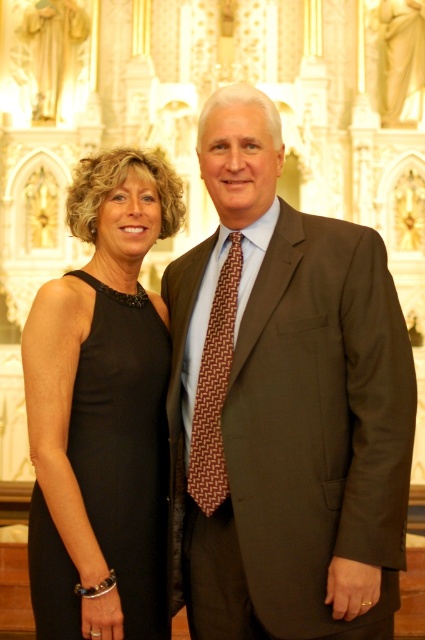
Question: Can you confirm if black satin dress at left is positioned below brown woven tie at center?

Choices:
 (A) yes
 (B) no

Answer: (A)

Question: Is brown textured suit at center to the left of black satin dress at left from the viewer's perspective?

Choices:
 (A) yes
 (B) no

Answer: (B)

Question: Which point is closer to the camera?

Choices:
 (A) (249, 540)
 (B) (187, 492)

Answer: (A)

Question: Which object is positioned farthest from the brown textured suit at center?

Choices:
 (A) brown woven tie at center
 (B) black satin dress at left

Answer: (B)

Question: Where is black satin dress at left located in relation to brown woven tie at center in the image?

Choices:
 (A) above
 (B) below

Answer: (B)

Question: Which object appears closest to the camera in this image?

Choices:
 (A) brown textured suit at center
 (B) black satin dress at left

Answer: (A)